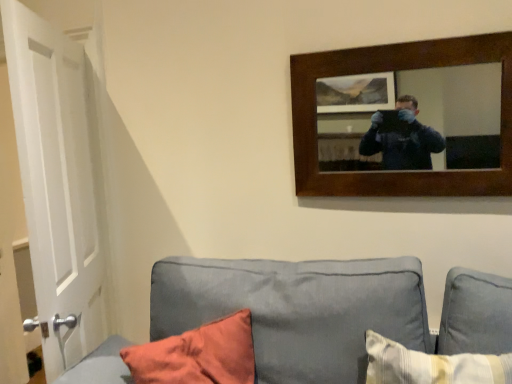
Question: From a real-world perspective, is gray fabric couch at lower center physically located above or below white matte door at left?

Choices:
 (A) above
 (B) below

Answer: (B)

Question: From their relative heights in the image, would you say gray fabric couch at lower center is taller or shorter than white matte door at left?

Choices:
 (A) tall
 (B) short

Answer: (B)

Question: Estimate the real-world distances between objects in this image. Which object is closer to the gray fabric couch at lower center?

Choices:
 (A) wooden-framed mirror at upper right
 (B) white matte door at left

Answer: (A)

Question: Which of these objects is positioned closest to the gray fabric couch at lower center?

Choices:
 (A) wooden-framed mirror at upper right
 (B) white matte door at left

Answer: (A)